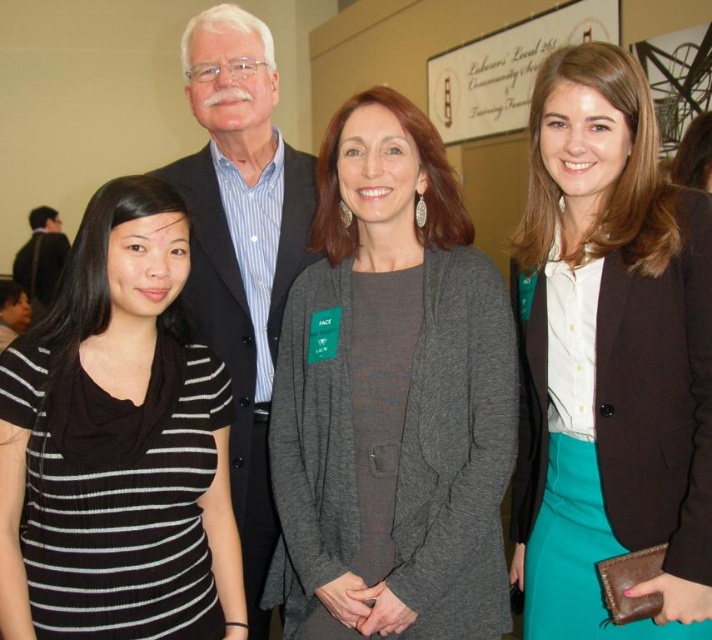
Question: Which is nearer to the matte black suit at center?

Choices:
 (A) gray soft sweater at center
 (B) wooden sign at upper center
 (C) teal satin skirt at center

Answer: (A)

Question: Is teal satin skirt at center to the right of matte black suit at left from the viewer's perspective?

Choices:
 (A) no
 (B) yes

Answer: (B)

Question: Which point is closer to the camera?

Choices:
 (A) matte black suit at center
 (B) teal satin skirt at center
 (C) gray soft sweater at center
 (D) wooden sign at upper center

Answer: (B)

Question: Is gray soft sweater at center wider than matte black suit at center?

Choices:
 (A) yes
 (B) no

Answer: (A)

Question: Can you confirm if gray soft sweater at center is wider than wooden sign at upper center?

Choices:
 (A) no
 (B) yes

Answer: (A)

Question: Which point is closer to the camera taking this photo?

Choices:
 (A) (253, 321)
 (B) (701, 275)
 (C) (409, 445)

Answer: (B)